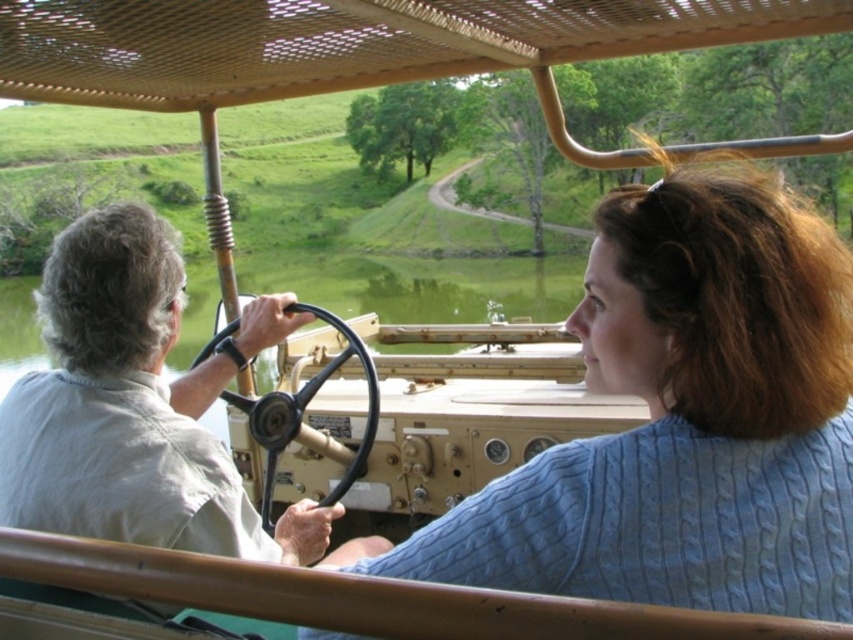
Question: Which of the following is the closest to the observer?

Choices:
 (A) (265, 484)
 (B) (759, 538)

Answer: (B)

Question: Among these points, which one is farthest from the camera?

Choices:
 (A) (705, 348)
 (B) (252, 416)

Answer: (B)

Question: Is blue cable-knit sweater at center in front of black rubber steering wheel at center?

Choices:
 (A) yes
 (B) no

Answer: (A)

Question: Does blue cable-knit sweater at center have a smaller size compared to black rubber steering wheel at center?

Choices:
 (A) yes
 (B) no

Answer: (A)

Question: Does blue cable-knit sweater at center have a greater width compared to black rubber steering wheel at center?

Choices:
 (A) yes
 (B) no

Answer: (B)